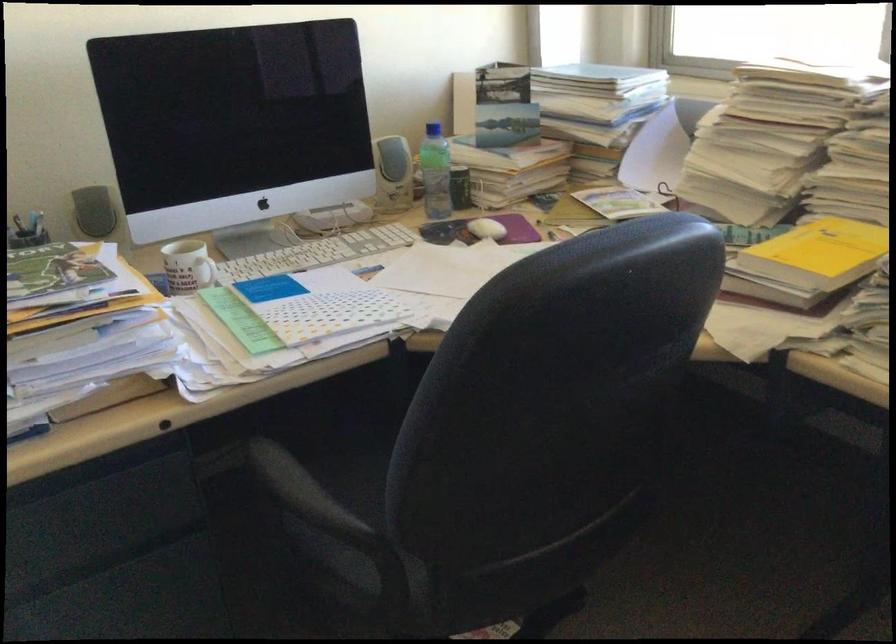
What do you see at coordinates (383, 433) in the screenshot? I see `the chair sitting surface` at bounding box center [383, 433].